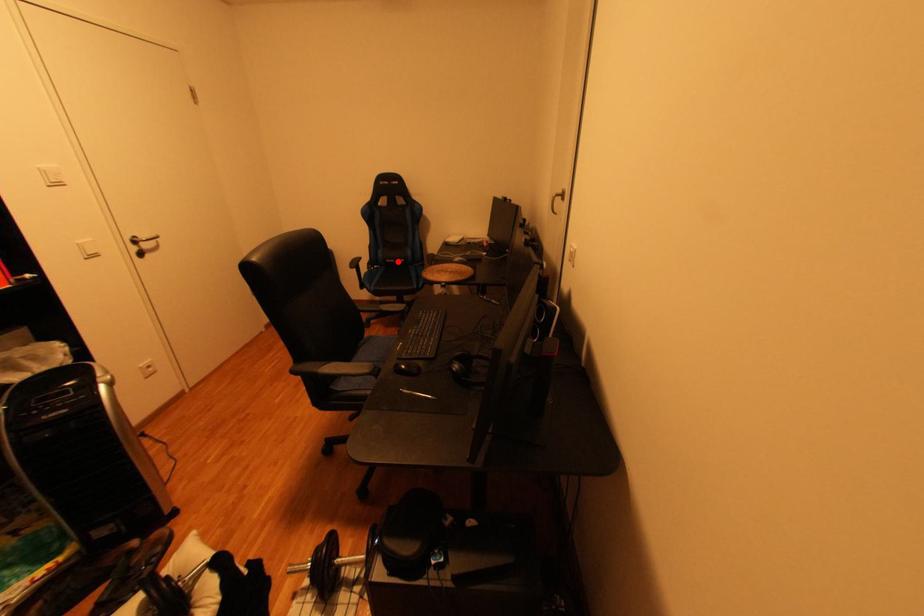
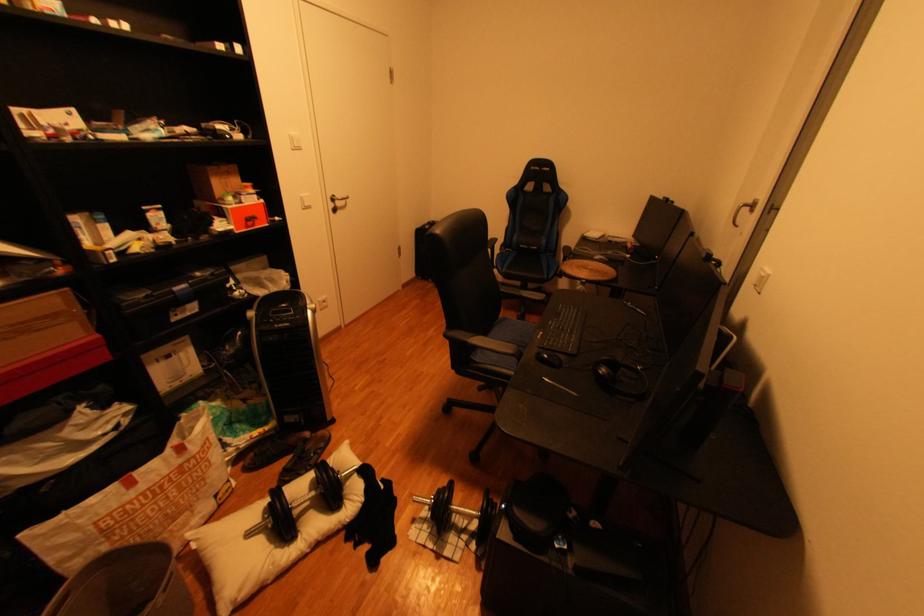
Locate, in the second image, the point that corresponds to the highlighted location in the first image.

(531, 246)